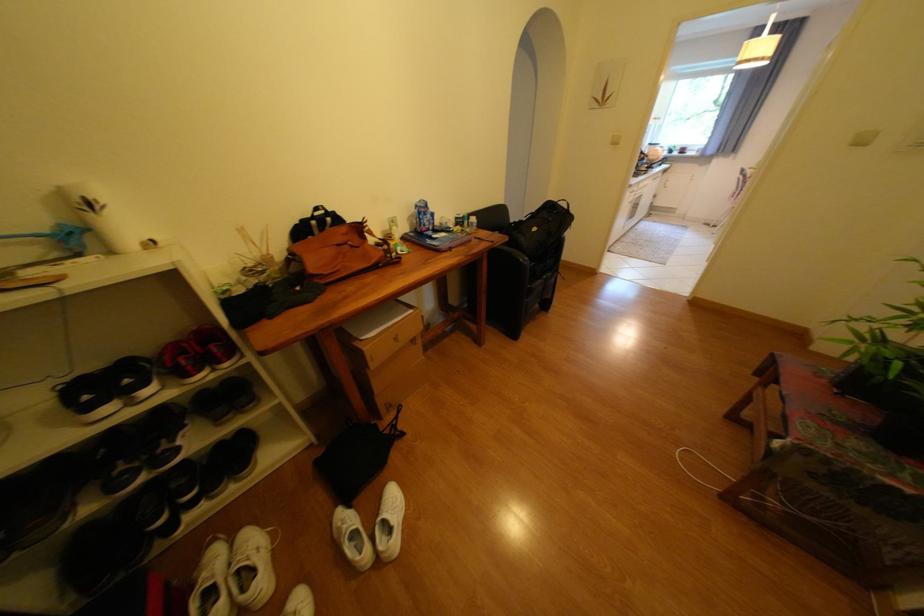
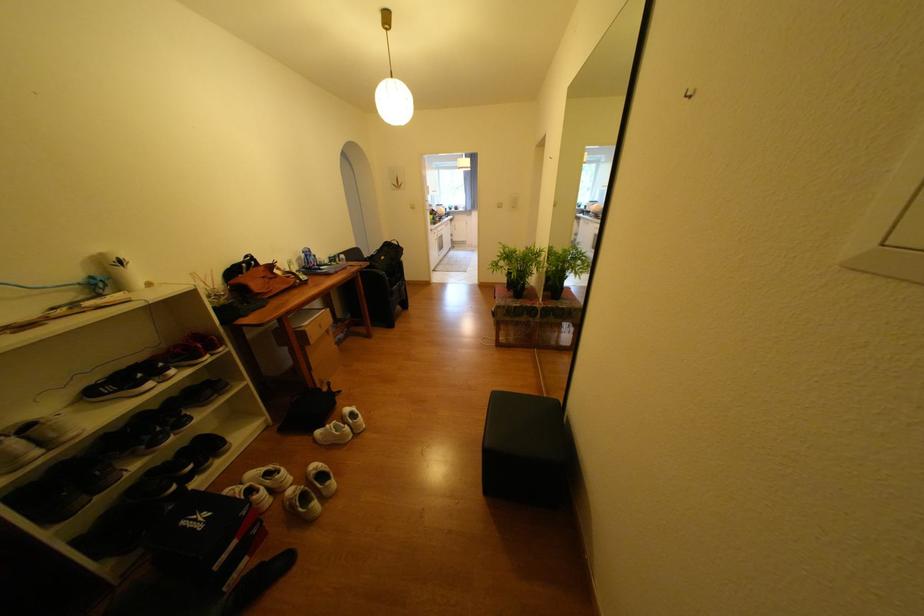
The point at (x=420, y=225) is marked in the first image. Where is the corresponding point in the second image?

(309, 265)